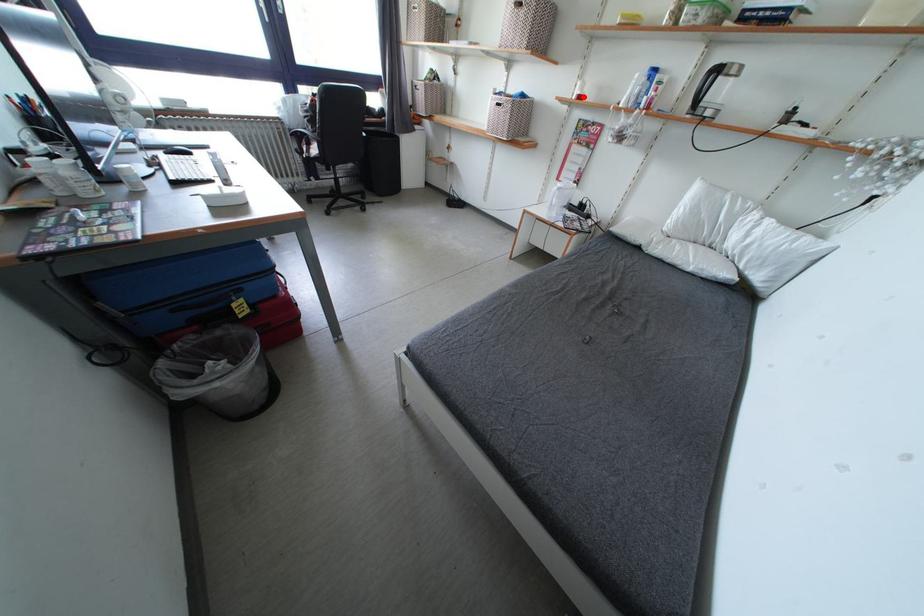
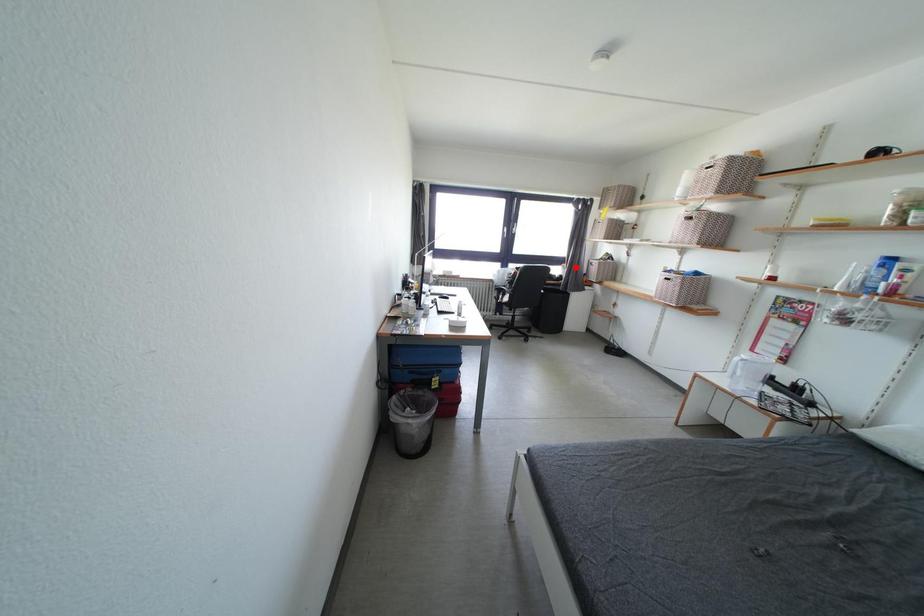
I am providing you with two images of the same scene from different viewpoints. A red point is marked on the first image and another point is marked on the second image. Does the point marked in image1 correspond to the same location as the one in image2?

No